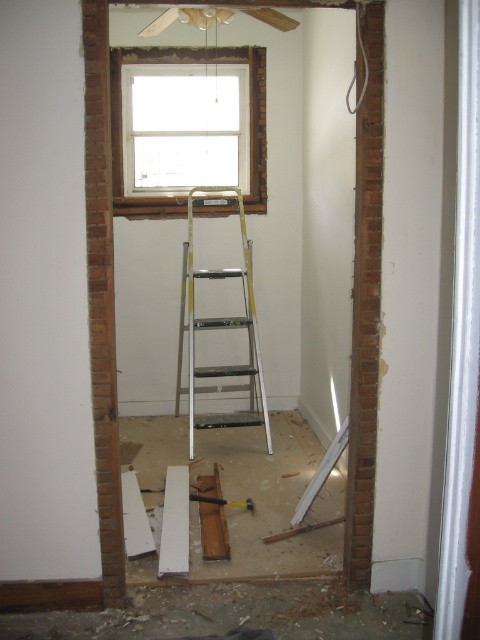
You are a construction worker standing in the middle of the room. You need to reach both the wooden frame at upper center and the white matte beam at center. Which object will you reach first as you move forward?

You will reach the wooden frame at upper center first because it is closer to you than the white matte beam at center.

You are standing at the entrance of the construction site and see two points marked in the image. Which point is closer to you, point (257, 76) or point (187, 541)?

Point (187, 541) is closer to you because point (257, 76) is behind it.